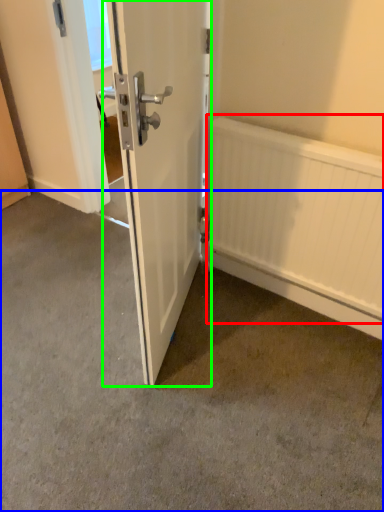
Question: Which object is the farthest from radiator (highlighted by a red box)? Choose among these: concrete (highlighted by a blue box) or door (highlighted by a green box).

Choices:
 (A) concrete
 (B) door

Answer: (A)